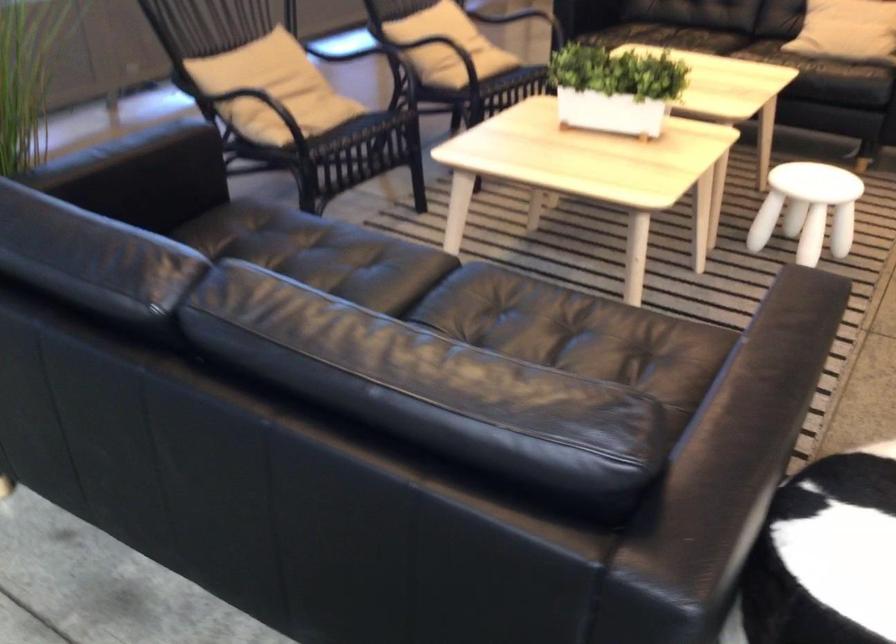
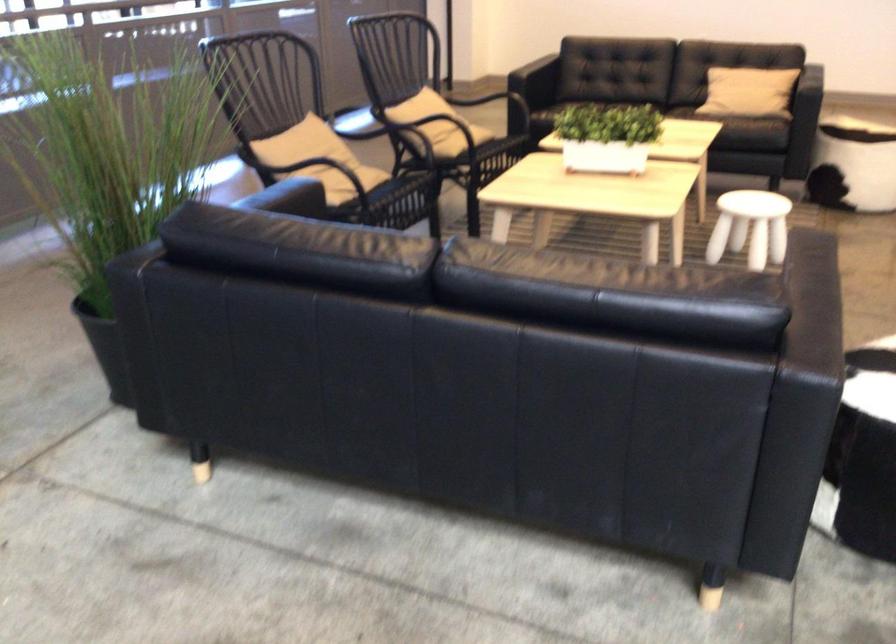
Question: I am providing you with two images of the same scene from different viewpoints. Which of the following objects are not visible in image2?

Choices:
 (A) black sofa sitting surface
 (B) black chair armrest
 (C) beige throw pillow
 (D) brown round coaster

Answer: (A)